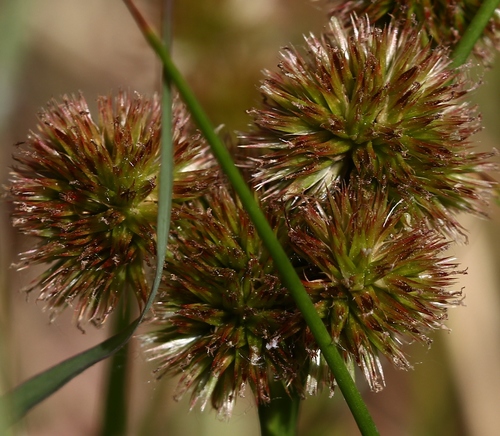
Where is `box`? This screenshot has height=436, width=500. box is located at coordinates (51, 70).